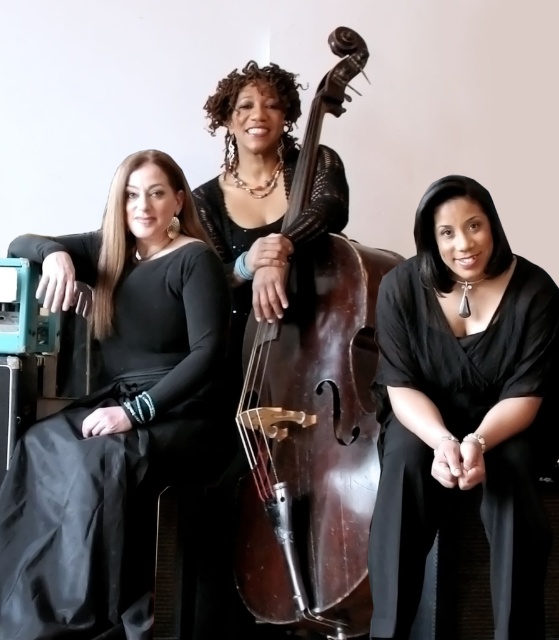
You are a photographer trying to capture a closeup of the black silk blouse at center and the dark brown polished wood cello at center. Since the camera can only focus on one object at a time, which object should you focus on first if you want to ensure the taller object is in focus?

The dark brown polished wood cello at center is taller than the black silk blouse at center, so you should focus on the dark brown polished wood cello at center first to ensure it is in focus.

You are a photographer trying to capture a closeup of the black silk blouse at center and the dark brown polished wood cello at center. Since the camera can only focus on one object at a time, which object should you choose to ensure it fills the frame more? Please explain your reasoning.

The dark brown polished wood cello at center is larger than the black silk blouse at center. Therefore, to ensure the object fills the frame more, you should focus on the dark brown polished wood cello at center.

You are a photographer setting up a shoot in a room with a black matte dress at left and a dark brown polished wood cello at center. You need to ensure that the dress and cello are visible in the frame. Which object should you prioritize positioning closer to the camera to ensure it doesn

The black matte dress at left is bigger than the dark brown polished wood cello at center, so you should prioritize positioning the black matte dress at left closer to the camera to ensure it is fully visible in the frame.